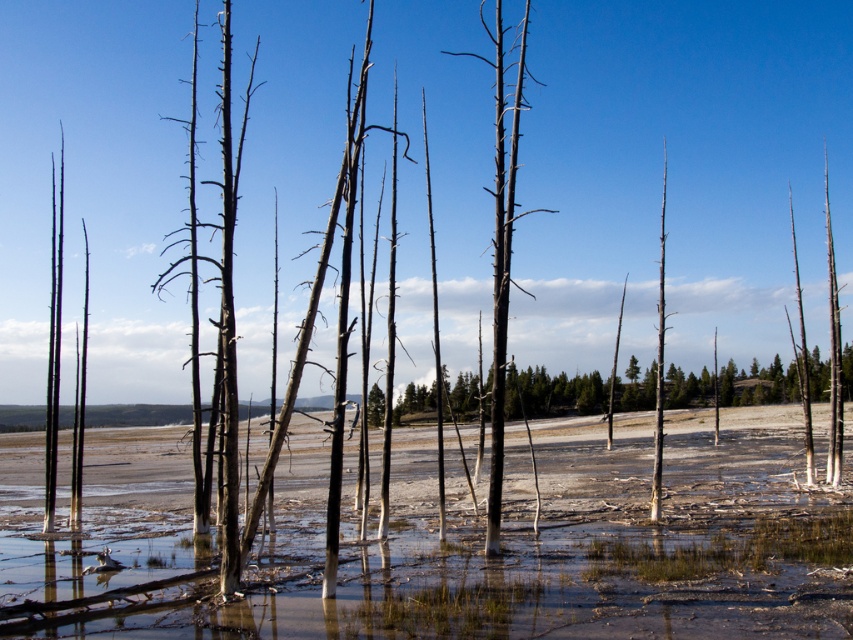
Question: Observing the image, what is the correct spatial positioning of charcoal textured tree trunk at center in reference to smooth gray tree trunk at center?

Choices:
 (A) right
 (B) left

Answer: (B)

Question: Observing the image, what is the correct spatial positioning of charcoal textured tree trunk at center in reference to smooth gray tree trunk at center?

Choices:
 (A) above
 (B) below

Answer: (A)

Question: Can you confirm if charcoal textured tree trunk at center is thinner than smooth gray tree trunk at center?

Choices:
 (A) no
 (B) yes

Answer: (B)